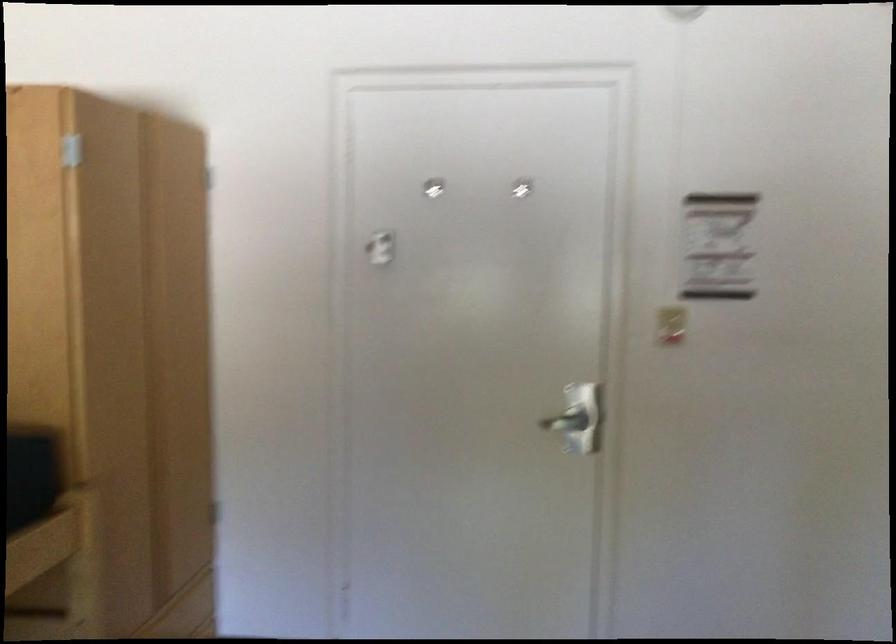
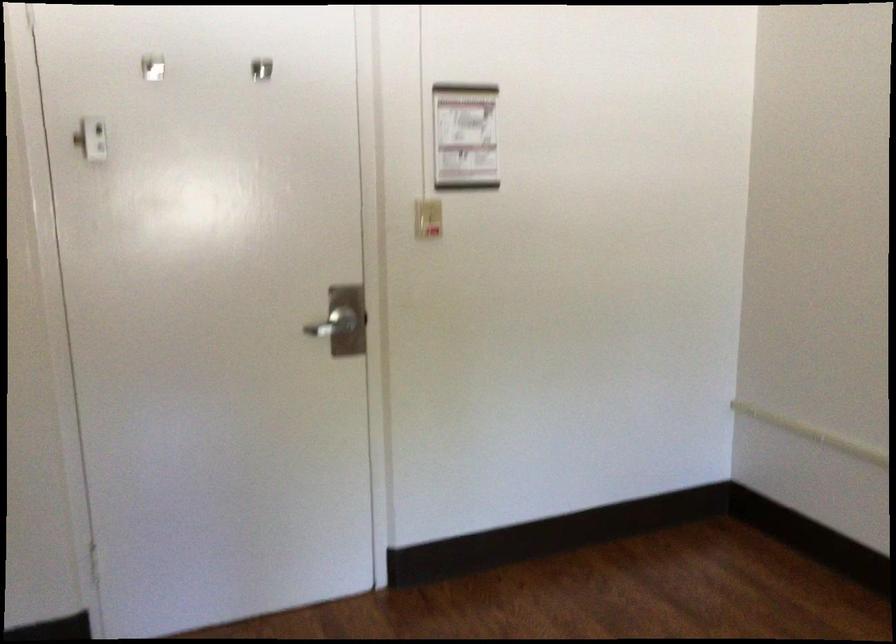
Find the pixel in the second image that matches point 374,254 in the first image.

(85, 149)